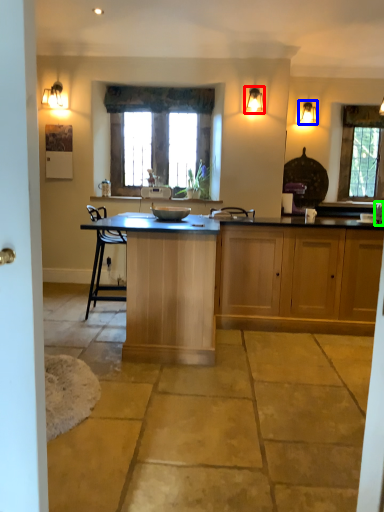
Question: Which object is the farthest from light fixture (highlighted by a red box)? Choose among these: light fixture (highlighted by a blue box) or faucet (highlighted by a green box).

Choices:
 (A) light fixture
 (B) faucet

Answer: (B)